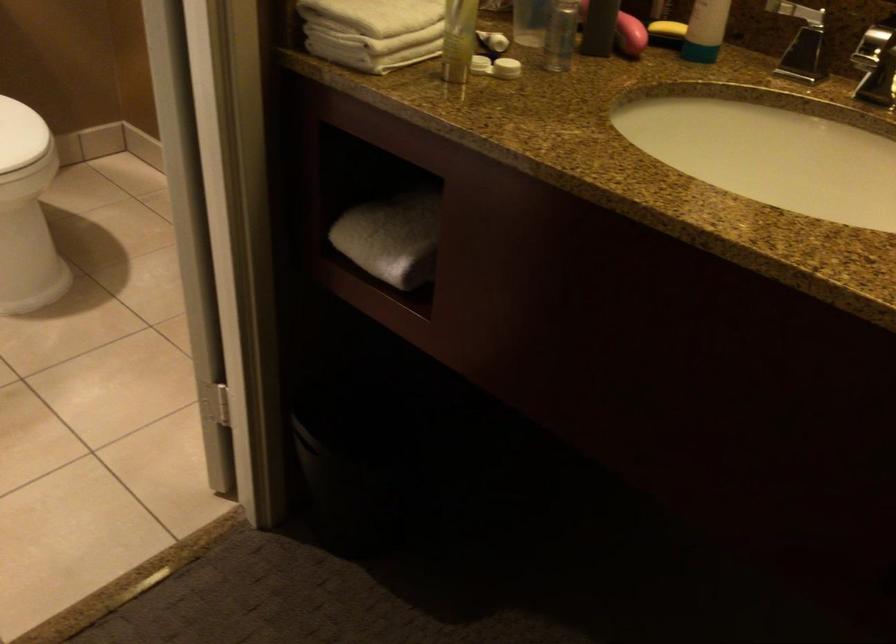
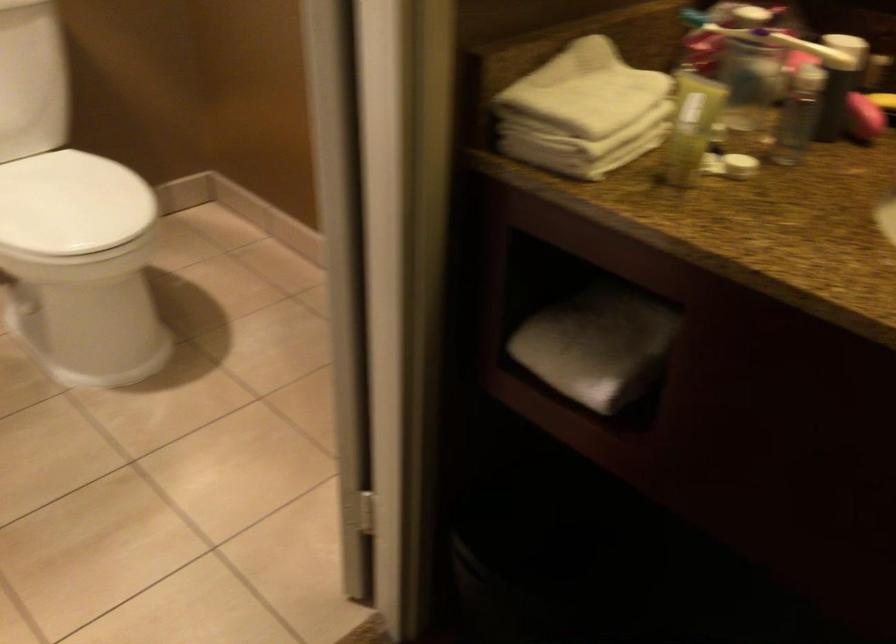
In a continuous first-person perspective shot, in which direction is the camera moving?

The cameraman moved toward left, forward.